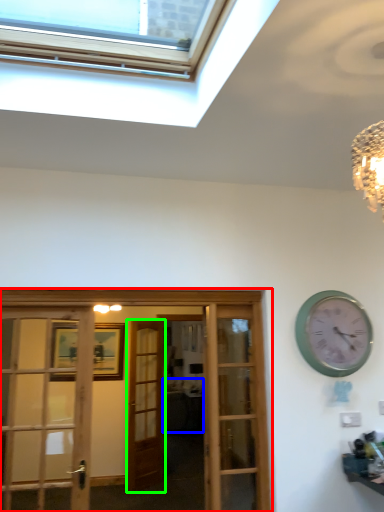
Question: Estimate the real-world distances between objects in this image. Which object is closer to hotel lobby (highlighted by a red box), studio couch (highlighted by a blue box) or door (highlighted by a green box)?

Choices:
 (A) studio couch
 (B) door

Answer: (B)